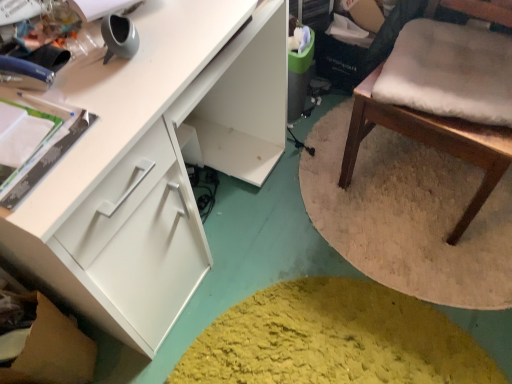
Locate an element on the screen. This screenshot has width=512, height=384. free location in front of wooden chair with white cushion at right is located at coordinates (443, 269).